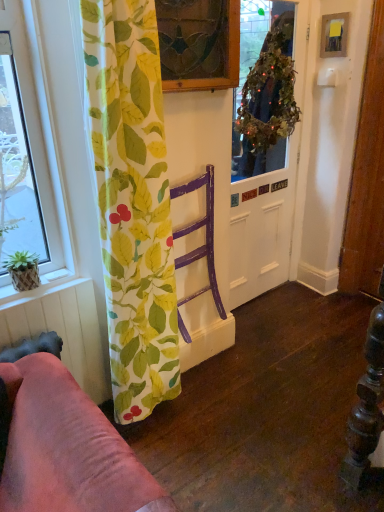
The image size is (384, 512). What are the coordinates of `blank area beneath stained glass window at upper center (from a real-world perspective)` in the screenshot? It's located at (188, 163).